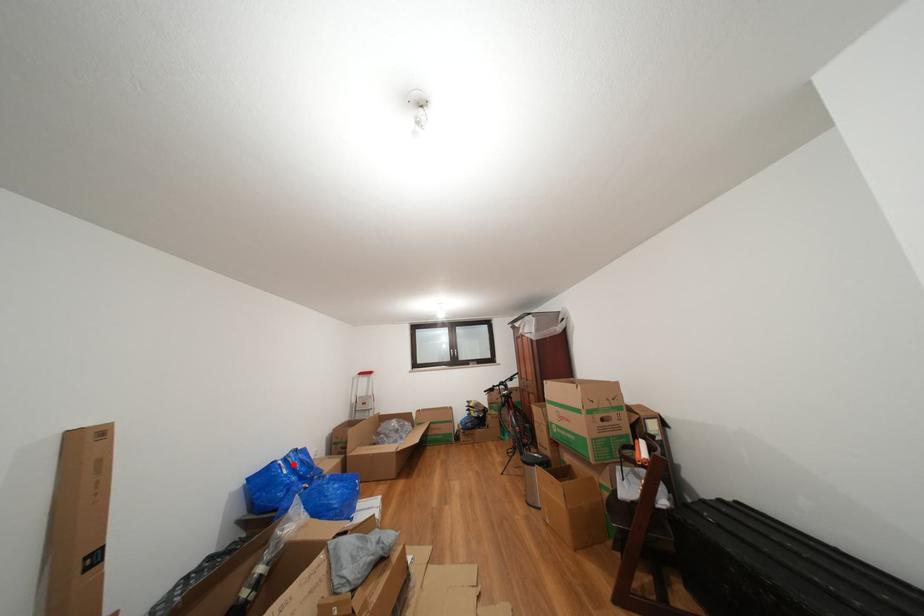
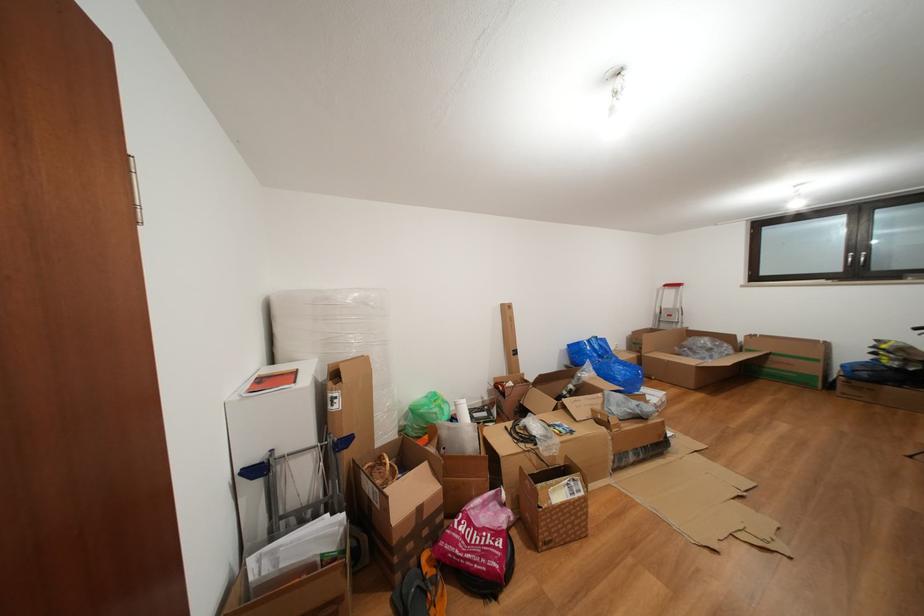
In the second image, find the point that corresponds to the highlighted location in the first image.

(597, 346)